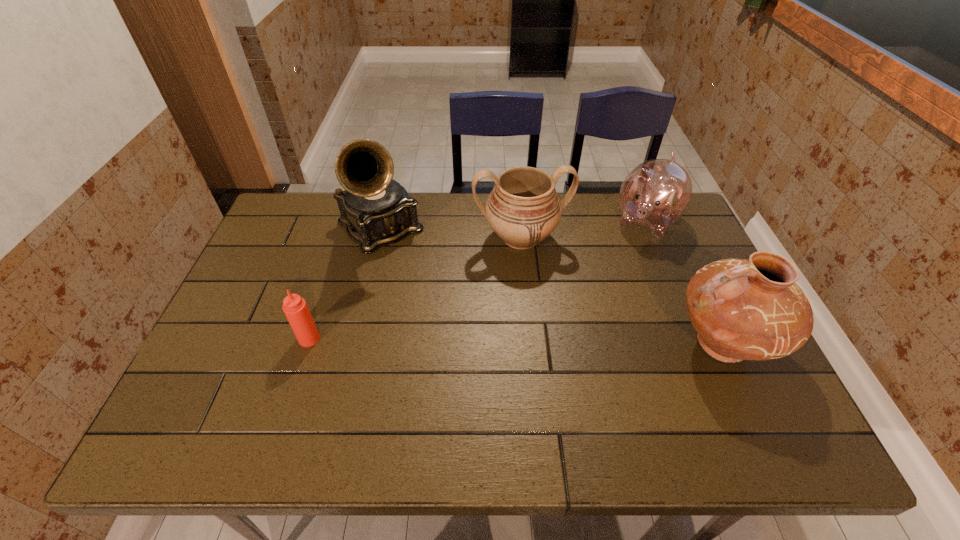
I want to click on object that is the closest to the urn, so click(x=655, y=194).

Identify the location of vacant position in the image that satisfies the following two spatial constraints: 1. on the front side of the pottery; 2. on the side of the phonograph record with the handle. (351, 344).